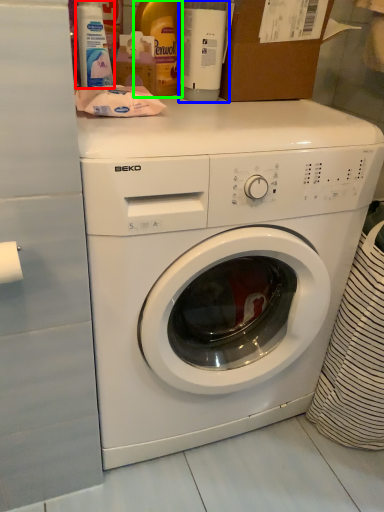
Question: Estimate the real-world distances between objects in this image. Which object is closer to cleaning product (highlighted by a red box), bottle (highlighted by a blue box) or bottle (highlighted by a green box)?

Choices:
 (A) bottle
 (B) bottle

Answer: (B)